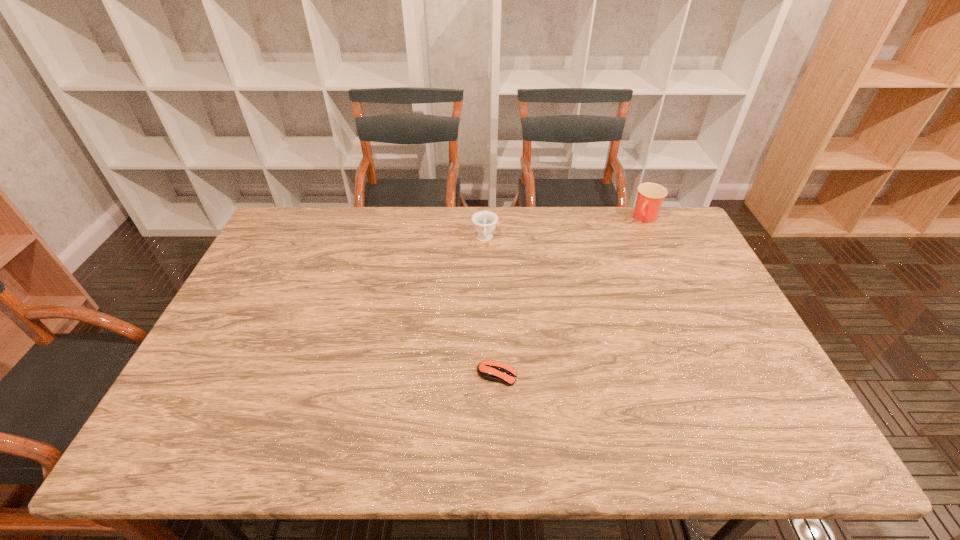
In order to click on teacup positioned at the far edge in this screenshot , I will do `click(484, 222)`.

Find the location of a particular element. This screenshot has height=540, width=960. object situated at the right edge is located at coordinates (650, 196).

This screenshot has width=960, height=540. I want to click on object situated at the far right corner, so click(x=650, y=196).

Find the location of a particular element. This screenshot has height=540, width=960. vacant space at the far edge of the desktop is located at coordinates (497, 224).

Where is `vacant space at the near edge of the desktop`? This screenshot has width=960, height=540. vacant space at the near edge of the desktop is located at coordinates coord(434,441).

Image resolution: width=960 pixels, height=540 pixels. Find the location of `free location at the left edge`. free location at the left edge is located at coordinates (252, 268).

At what (x,y) coordinates should I click in order to perform the action: click on vacant space at the right edge of the desktop. Please return your answer as a coordinate pair (x, y). The height and width of the screenshot is (540, 960). Looking at the image, I should click on (727, 386).

In the image, there is a desktop. Where is `vacant space at the far right corner`? The height and width of the screenshot is (540, 960). vacant space at the far right corner is located at coordinates (656, 234).

You are a GUI agent. You are given a task and a screenshot of the screen. Output one action in this format:
    pyautogui.click(x=<x>, y=<y>)
    Task: Click on the vacant space that's between the teacup and the shortest object
    The height and width of the screenshot is (540, 960).
    Given the screenshot: What is the action you would take?
    (x=491, y=307)

This screenshot has width=960, height=540. Identify the location of free spot between the teacup and the rightmost object. tap(565, 229).